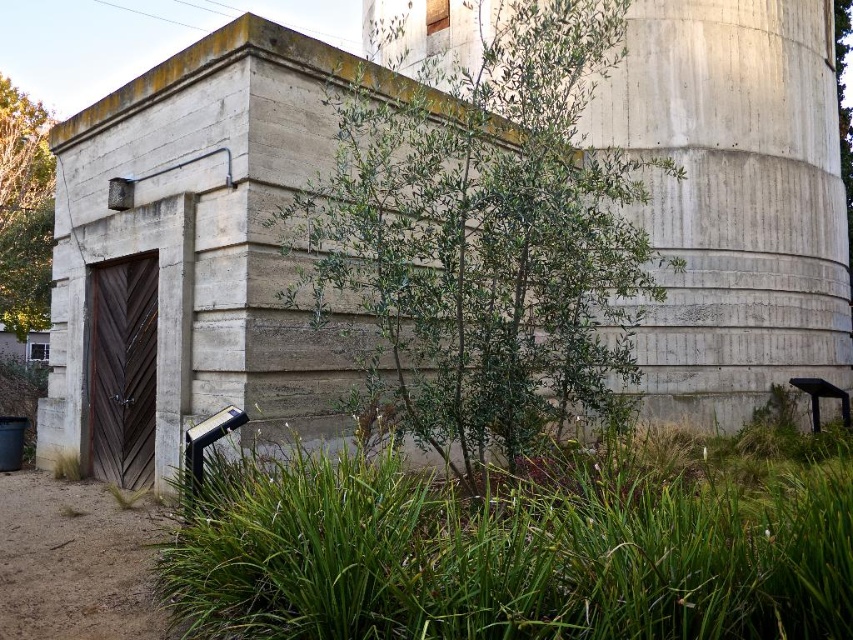
What do you see at coordinates (482, 237) in the screenshot? The width and height of the screenshot is (853, 640). I see `green leafy shrub at center` at bounding box center [482, 237].

Is point (465, 305) more distant than point (32, 109)?

No, it is not.

Is point (610, 356) positioned before point (28, 260)?

Yes, point (610, 356) is closer to viewer.

Find the location of a particular element. green leafy shrub at center is located at coordinates (482, 237).